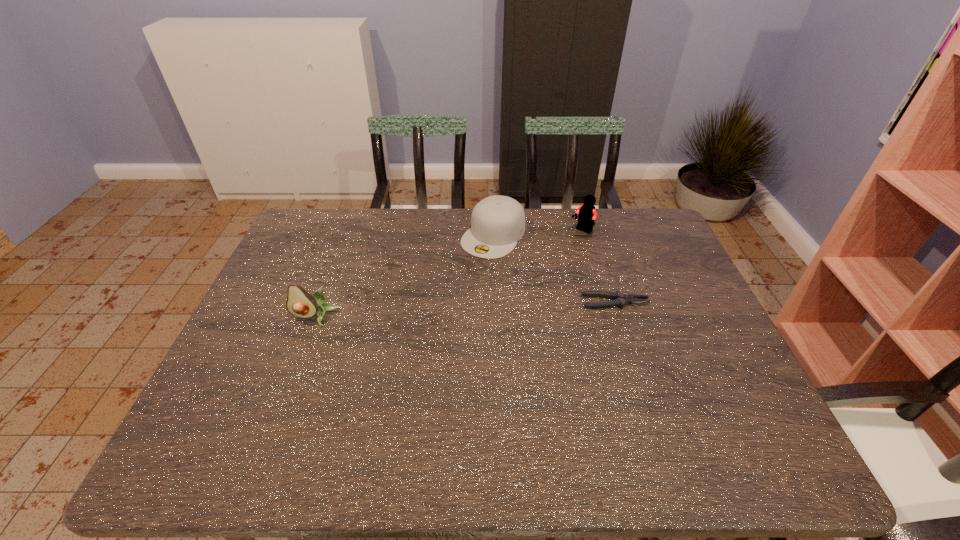
Locate an element on the screen. the leftmost object is located at coordinates (300, 303).

Identify the location of the shortest object. The height and width of the screenshot is (540, 960). (620, 299).

Locate an element on the screen. This screenshot has width=960, height=540. the second shortest object is located at coordinates (497, 222).

This screenshot has width=960, height=540. Identify the location of cap. (497, 222).

At what (x,y) coordinates should I click in order to perform the action: click on Lego. Please return your answer as a coordinate pair (x, y). The width and height of the screenshot is (960, 540). Looking at the image, I should click on (587, 214).

The image size is (960, 540). Find the location of `free point located 0.070m on the seed side of the leftmost object`. free point located 0.070m on the seed side of the leftmost object is located at coordinates (304, 347).

Find the location of a particular element. free space located 0.060m on the front-facing side of the second object from left to right is located at coordinates (470, 268).

I want to click on free location located 0.120m on the front-facing side of the second object from left to right, so click(461, 280).

The height and width of the screenshot is (540, 960). What are the coordinates of `vacant region located 0.280m on the front-facing side of the second object from left to right` in the screenshot? It's located at (433, 315).

Where is `free region located on the front-facing side of the Lego`? free region located on the front-facing side of the Lego is located at coordinates (564, 246).